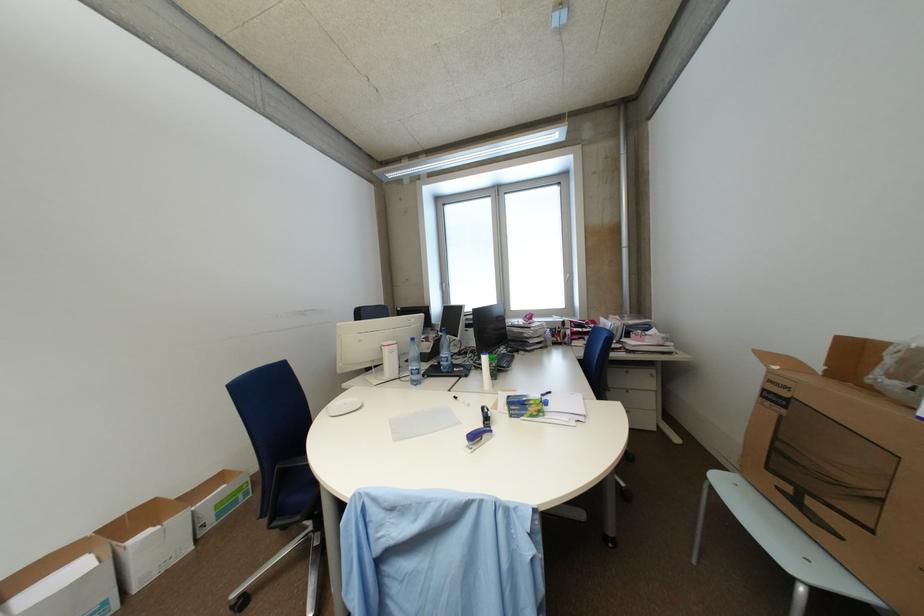
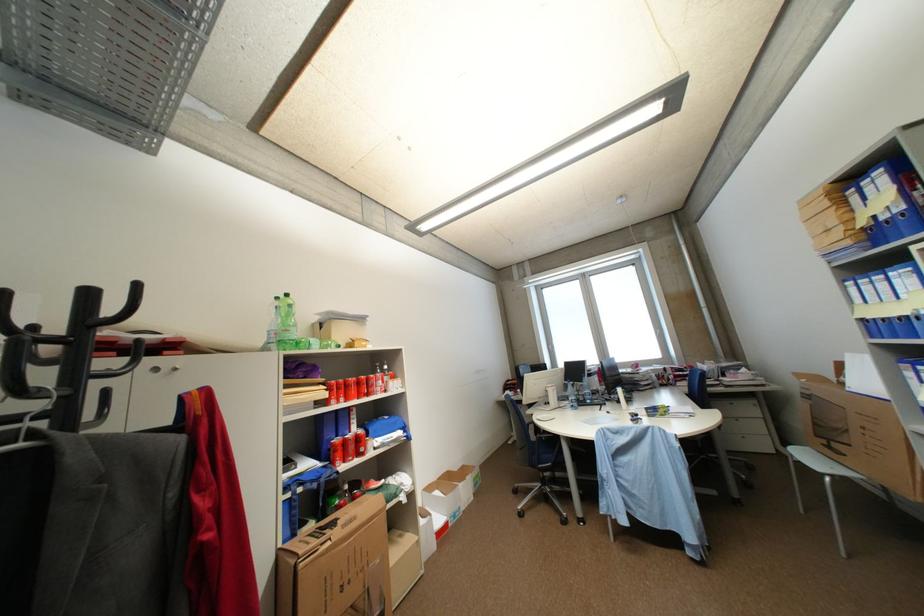
The images are taken continuously from a first-person perspective. In which direction are you moving?

The cameraman walked toward left, backward.